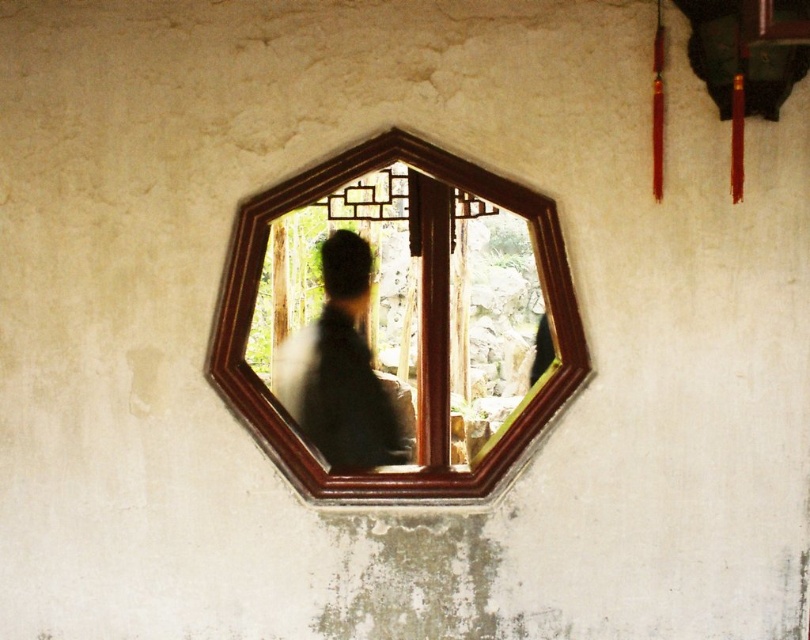
Is wooden frame mirror at center further to the viewer compared to silhouette fabric at center?

That is False.

Can you confirm if wooden frame mirror at center is shorter than silhouette fabric at center?

No, wooden frame mirror at center is not shorter than silhouette fabric at center.

Which is behind, point (565, 330) or point (340, 364)?

Point (340, 364)

Locate an element on the screen. wooden frame mirror at center is located at coordinates (275, 401).